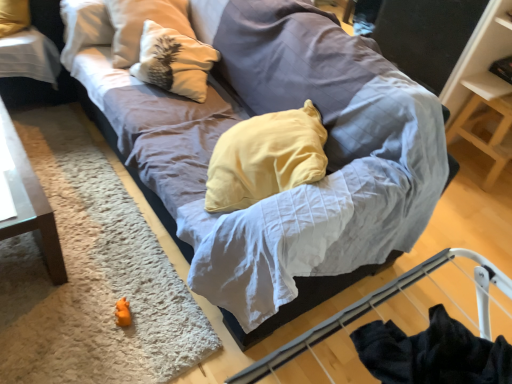
What do you see at coordinates (35, 45) in the screenshot? I see `black glossy table at upper left` at bounding box center [35, 45].

Describe the element at coordinates (91, 276) in the screenshot. I see `white shaggy rug at lower left` at that location.

Locate an element on the screen. The width and height of the screenshot is (512, 384). orange plush toy at lower left is located at coordinates (123, 313).

Locate an element on the screen. white textured pillow at upper left is located at coordinates (174, 61).

Describe the element at coordinates (478, 55) in the screenshot. Image resolution: width=512 pixels, height=384 pixels. I see `wooden shelf at upper right` at that location.

What is the approximate height of wooden shelf at upper right?

It is 34.97 inches.

You are a GUI agent. You are given a task and a screenshot of the screen. Output one action in this format:
    pyautogui.click(x=<x>, y=<y>)
    Task: Click on the black glossy table at upper left
    This screenshot has height=384, width=512.
    Given the screenshot: What is the action you would take?
    pyautogui.click(x=35, y=45)

Are black glossy table at upper left and textured gray couch at center making contact?

No, black glossy table at upper left is not beside textured gray couch at center.

What's the angular difference between black glossy table at upper left and textured gray couch at center's facing directions?

0.569 degrees.

Consider the image. Is black glossy table at upper left oriented towards textured gray couch at center?

No, black glossy table at upper left is not aimed at textured gray couch at center.

Can textured gray couch at center be found inside black glossy table at upper left?

No, textured gray couch at center is not surrounded by black glossy table at upper left.

Choose the correct answer: Is black glossy table at upper left inside white shaggy rug at lower left or outside it?

black glossy table at upper left is located beyond the bounds of white shaggy rug at lower left.

Is the surface of black glossy table at upper left in direct contact with white shaggy rug at lower left?

No, black glossy table at upper left is not making contact with white shaggy rug at lower left.

Locate an element on the screen. The width and height of the screenshot is (512, 384). mat on the right side of black glossy table at upper left is located at coordinates point(91,276).

Considering the sizes of objects black glossy table at upper left and white shaggy rug at lower left in the image provided, who is taller, black glossy table at upper left or white shaggy rug at lower left?

With more height is black glossy table at upper left.

Is white shaggy rug at lower left situated inside black glossy table at upper left or outside?

white shaggy rug at lower left lies outside black glossy table at upper left.

Between white shaggy rug at lower left and black glossy table at upper left, which one has less height?

white shaggy rug at lower left.

How many degrees apart are the facing directions of white shaggy rug at lower left and black glossy table at upper left?

89.2 degrees separate the facing orientations of white shaggy rug at lower left and black glossy table at upper left.

Which is more to the left, white shaggy rug at lower left or black glossy table at upper left?

black glossy table at upper left is more to the left.

Does point (163, 37) come in front of point (157, 142)?

No, (163, 37) is further to viewer.

From a real-world perspective, is white textured pillow at upper left on top of textured gray couch at center?

Yes.

Between white textured pillow at upper left and textured gray couch at center, which one is positioned in front?

textured gray couch at center is more forward.

Considering the sizes of objects white textured pillow at upper left and textured gray couch at center in the image provided, who is bigger, white textured pillow at upper left or textured gray couch at center?

With larger size is textured gray couch at center.

Considering the sizes of objects textured gray couch at center and orange plush toy at lower left in the image provided, who is wider, textured gray couch at center or orange plush toy at lower left?

Wider between the two is textured gray couch at center.

Between textured gray couch at center and orange plush toy at lower left, which one has less height?

orange plush toy at lower left.

Is textured gray couch at center with orange plush toy at lower left?

No, textured gray couch at center is not touching orange plush toy at lower left.

Which is in front, point (339, 24) or point (126, 310)?

Point (126, 310)

Looking at this image, considering the relative sizes of wooden shelf at upper right and white textured pillow at upper left in the image provided, is wooden shelf at upper right taller than white textured pillow at upper left?

Indeed, wooden shelf at upper right has a greater height compared to white textured pillow at upper left.

Which point is more distant from viewer, [481,64] or [198,65]?

Positioned behind is point [481,64].

Which object is thinner, wooden shelf at upper right or white textured pillow at upper left?

With smaller width is wooden shelf at upper right.

Is black glossy table at upper left inside or outside of wooden shelf at upper right?

black glossy table at upper left is not inside wooden shelf at upper right, it's outside.

From a real-world perspective, is black glossy table at upper left over wooden shelf at upper right?

Incorrect, from a real-world perspective, black glossy table at upper left is lower than wooden shelf at upper right.

Based on the photo, how many degrees apart are the facing directions of black glossy table at upper left and wooden shelf at upper right?

89.3 degrees separate the facing orientations of black glossy table at upper left and wooden shelf at upper right.

Which object is thinner, black glossy table at upper left or wooden shelf at upper right?

Thinner between the two is wooden shelf at upper right.

This screenshot has height=384, width=512. In order to click on table below the textured gray couch at center (from a real-world perspective) in this screenshot , I will do `click(35, 45)`.

This screenshot has height=384, width=512. Identify the location of table lying on the left of white shaggy rug at lower left. (35, 45).

Considering their positions, is white textured pillow at upper left positioned further to orange plush toy at lower left than black glossy table at upper left?

The object further to orange plush toy at lower left is black glossy table at upper left.

Consider the image. Looking at the image, which one is located further to white shaggy rug at lower left, black glossy table at upper left or textured gray couch at center?

Based on the image, black glossy table at upper left appears to be further to white shaggy rug at lower left.

When comparing their distances from white textured pillow at upper left, does wooden shelf at upper right or black glossy table at upper left seem closer?

Among the two, black glossy table at upper left is located nearer to white textured pillow at upper left.

Which object lies nearer to the anchor point wooden shelf at upper right, white textured pillow at upper left or white shaggy rug at lower left?

white textured pillow at upper left is positioned closer to the anchor wooden shelf at upper right.

Looking at the image, which one is located closer to white textured pillow at upper left, textured gray couch at center or orange plush toy at lower left?

textured gray couch at center lies closer to white textured pillow at upper left than the other object.

Considering their positions, is orange plush toy at lower left positioned closer to textured gray couch at center than white shaggy rug at lower left?

white shaggy rug at lower left.

Looking at the image, which one is located closer to wooden shelf at upper right, textured gray couch at center or orange plush toy at lower left?

Based on the image, textured gray couch at center appears to be nearer to wooden shelf at upper right.

Considering their positions, is black glossy table at upper left positioned closer to white shaggy rug at lower left than wooden shelf at upper right?

Based on the image, black glossy table at upper left appears to be nearer to white shaggy rug at lower left.

Identify the location of studio couch between white textured pillow at upper left and orange plush toy at lower left in the vertical direction. (265, 112).

I want to click on studio couch between orange plush toy at lower left and wooden shelf at upper right in the horizontal direction, so click(265, 112).

The height and width of the screenshot is (384, 512). Identify the location of pillow between black glossy table at upper left and wooden shelf at upper right from left to right. (174, 61).

Find the location of a particular element. toy between white shaggy rug at lower left and wooden shelf at upper right in the horizontal direction is located at coordinates (123, 313).